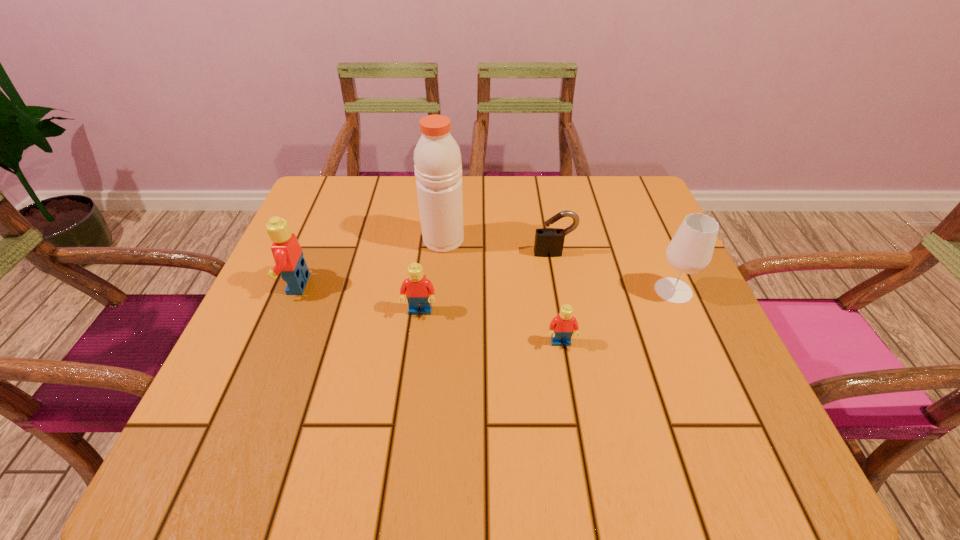
Locate an element on the screen. the farthest Lego is located at coordinates (288, 255).

The width and height of the screenshot is (960, 540). Identify the location of the leftmost object. (288, 255).

You are a GUI agent. You are given a task and a screenshot of the screen. Output one action in this format:
    pyautogui.click(x=<x>, y=<y>)
    Task: Click on the second shortest Lego
    This screenshot has width=960, height=540.
    Given the screenshot: What is the action you would take?
    pyautogui.click(x=419, y=290)

Where is `the second nearest Lego`? The height and width of the screenshot is (540, 960). the second nearest Lego is located at coordinates (419, 290).

Where is `the rightmost Lego`? The height and width of the screenshot is (540, 960). the rightmost Lego is located at coordinates (562, 326).

Identify the location of the shortest Lego. This screenshot has height=540, width=960. (562, 326).

At what (x,y) coordinates should I click in order to perform the action: click on shaker. Please return your answer as a coordinate pair (x, y). The height and width of the screenshot is (540, 960). Looking at the image, I should click on (438, 168).

In order to click on glass in this screenshot , I will do tap(690, 251).

I want to click on padlock, so click(x=549, y=242).

You are a GUI agent. You are given a task and a screenshot of the screen. Output one action in this format:
    pyautogui.click(x=<x>, y=<y>)
    Task: Click on the vacant region located on the face of the second tallest Lego
    The height and width of the screenshot is (540, 960).
    Given the screenshot: What is the action you would take?
    pyautogui.click(x=413, y=370)